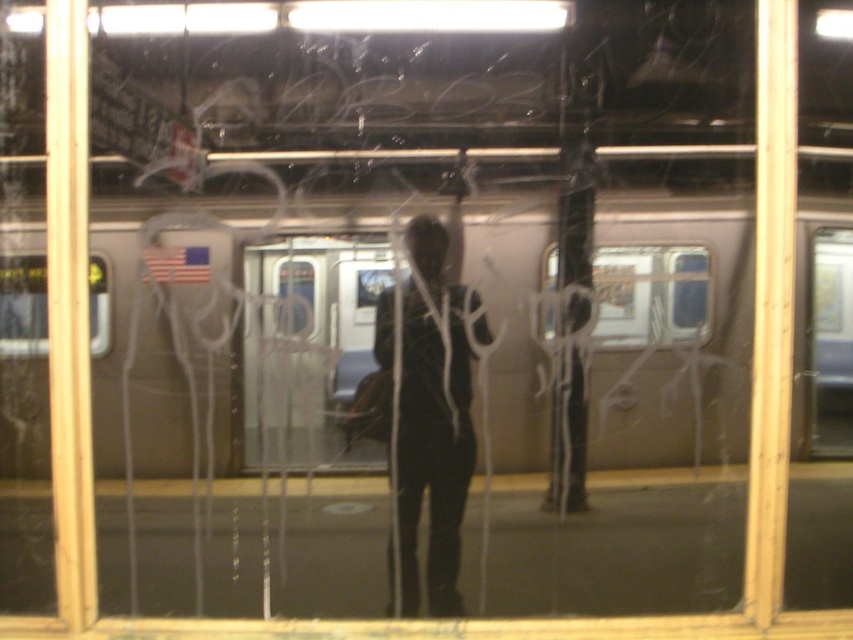
You are a passenger waiting at the subway station. You look through the dirty window and see the silver metallic train at center and the black matte clothing at center. Which object is closer to you through the window?

The silver metallic train at center is closer to you because it is in front of the black matte clothing at center.

You are a passenger on the silver metallic train at center. You want to look outside through the clear glass train window at center. Can you see the outside clearly through the window?

The silver metallic train at center is in front of the clear glass train window at center, blocking your view. Therefore, you cannot see the outside clearly through the clear glass train window at center.